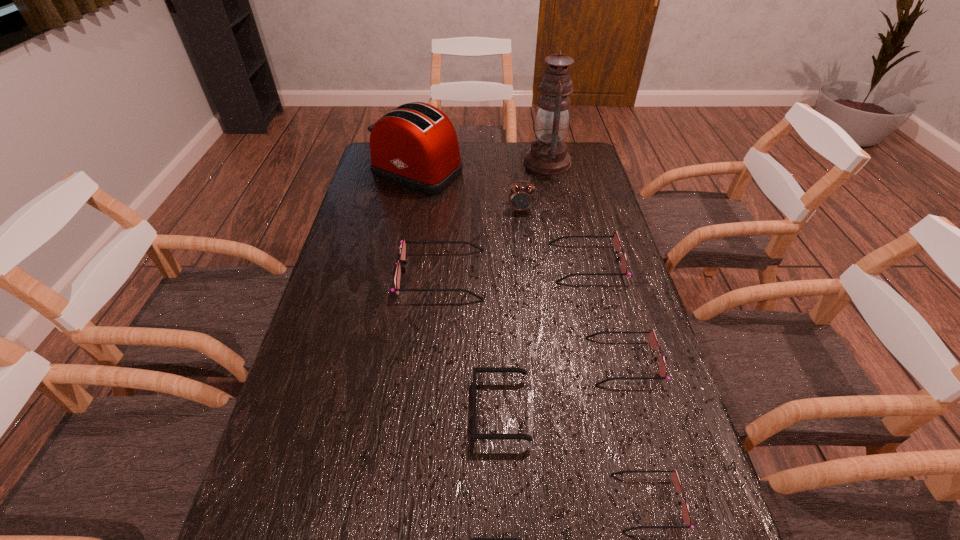
Where is `the tallest object`? The image size is (960, 540). the tallest object is located at coordinates (548, 155).

This screenshot has height=540, width=960. Identify the location of toaster. (415, 145).

The height and width of the screenshot is (540, 960). Find the location of `red toaster`. red toaster is located at coordinates (415, 145).

Image resolution: width=960 pixels, height=540 pixels. I want to click on the seventh nearest object, so click(x=521, y=198).

The height and width of the screenshot is (540, 960). Identify the location of alarm clock. (521, 198).

Where is `the leftmost pink sunglasses`? the leftmost pink sunglasses is located at coordinates (403, 242).

Identify the location of the tallest sunglasses. (403, 242).

The image size is (960, 540). Identify the location of the fifth shortest sunglasses. (617, 245).

Identify the location of the third smallest pink sunglasses. This screenshot has height=540, width=960. (617, 245).

At what (x,y) coordinates should I click in order to perform the action: click on the fourth shortest object. Please return your answer as a coordinate pair (x, y). Looking at the image, I should click on (652, 339).